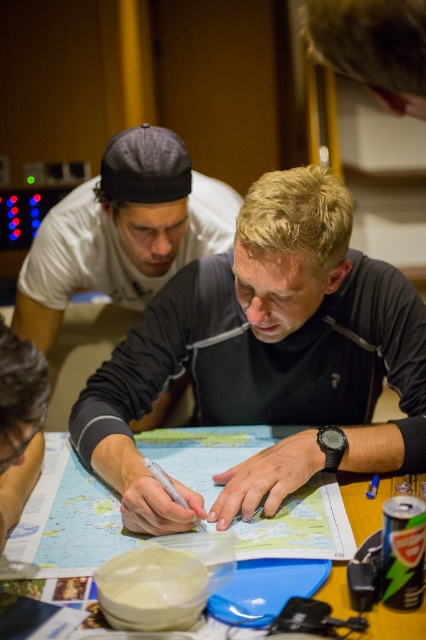
You are a photographer standing behind the black matte shirt at center and the smooth wooden pen at lower left. You want to take a photo that captures both objects in the frame. Which object should you position closer to the camera to ensure both are fully visible?

The black matte shirt at center is taller than the smooth wooden pen at lower left, so you should position the smooth wooden pen at lower left closer to the camera to ensure both are fully visible.